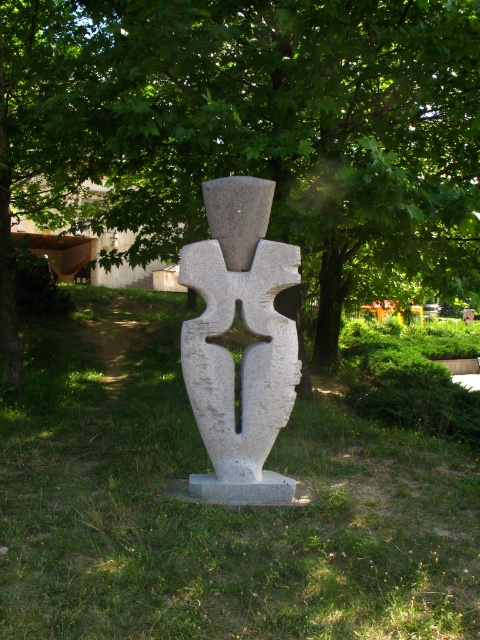
Is point (132, 116) positioned in front of point (14, 474)?

No.

Is green leafy tree at center wider than green grass at center?

Indeed, green leafy tree at center has a greater width compared to green grass at center.

Is point (165, 0) less distant than point (71, 492)?

No, (165, 0) is behind (71, 492).

Where is `green leafy tree at center`? This screenshot has height=640, width=480. green leafy tree at center is located at coordinates (249, 131).

Which is in front, point (134, 124) or point (250, 314)?

Positioned in front is point (250, 314).

Which is behind, point (201, 49) or point (227, 424)?

Positioned behind is point (201, 49).

Between point (60, 182) and point (251, 484), which one is positioned behind?

The point (60, 182) is behind.

Locate an element on the screen. This screenshot has height=640, width=480. green leafy tree at center is located at coordinates (249, 131).

Can you confirm if green grass at center is positioned to the right of white stone sculpture at center?

No, green grass at center is not to the right of white stone sculpture at center.

Is point (332, 602) less distant than point (212, 499)?

Yes.

The height and width of the screenshot is (640, 480). Find the location of `green grass at center`. green grass at center is located at coordinates (214, 506).